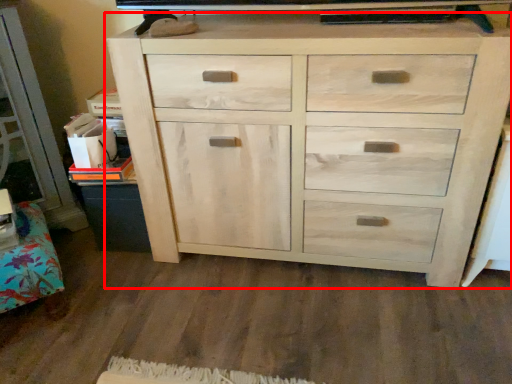
Question: From the image's perspective, what is the correct spatial positioning of chest of drawers (annotated by the red box) in reference to cabinetry?

Choices:
 (A) above
 (B) below

Answer: (A)